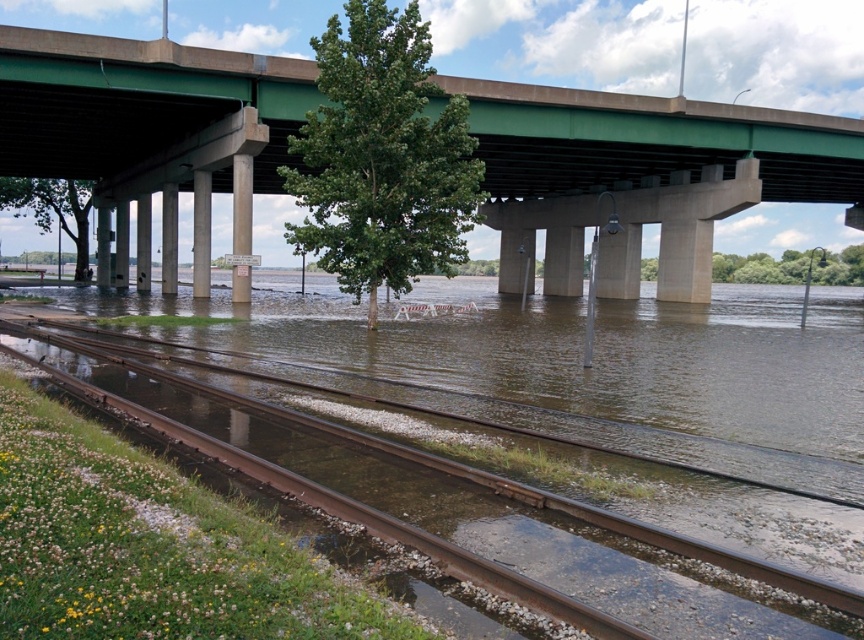
Measure the distance between point (656, 109) and camera.

44.65 meters

Who is positioned more to the left, green concrete bridge at upper center or concrete signpost at center?

From the viewer's perspective, concrete signpost at center appears more on the left side.

Which is behind, point (179, 88) or point (232, 218)?

Positioned behind is point (232, 218).

Identify the location of green concrete bridge at upper center. (642, 170).

Can you confirm if rusty metal train track at lower left is smaller than concrete at center?

No, rusty metal train track at lower left is not smaller than concrete at center.

Between point (638, 548) and point (167, 278), which one is positioned in front?

Positioned in front is point (638, 548).

At what (x,y) coordinates should I click in order to perform the action: click on rusty metal train track at lower left. Please return your answer as a coordinate pair (x, y). The image size is (864, 640). Looking at the image, I should click on (459, 515).

How distant is concrete signpost at center from concrete at center?

They are 11.10 meters apart.

Consider the image. Is concrete signpost at center closer to the viewer compared to concrete at center?

Yes, concrete signpost at center is closer to the viewer.

This screenshot has height=640, width=864. What do you see at coordinates (240, 204) in the screenshot? I see `concrete signpost at center` at bounding box center [240, 204].

The height and width of the screenshot is (640, 864). In order to click on concrete signpost at center in this screenshot , I will do `click(240, 204)`.